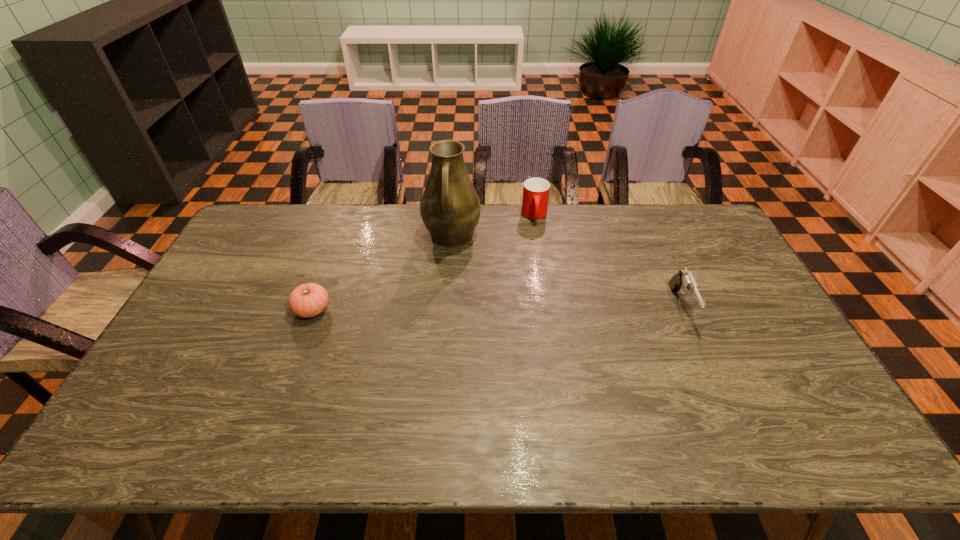
Locate an element on the screen. vacant space on the desktop that is between the tomato and the rightmost object and is positioned on the handle side of the third object from right to left is located at coordinates (444, 308).

Identify the location of free spot on the desktop that is between the tomato and the gun and is positioned on the side of the third object from left to right with the handle. (540, 308).